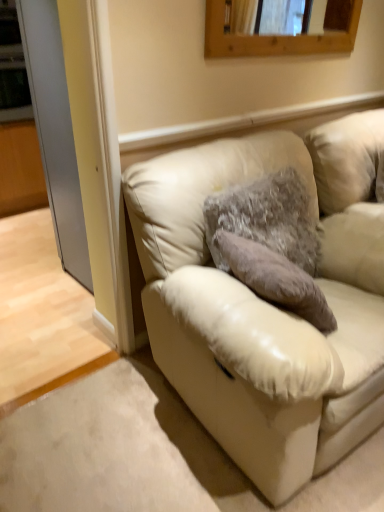
Question: Can you confirm if fuzzy fabric pillow at center is shorter than beige leather couch at lower right?

Choices:
 (A) yes
 (B) no

Answer: (A)

Question: Can you confirm if fuzzy fabric pillow at center is wider than beige leather couch at lower right?

Choices:
 (A) yes
 (B) no

Answer: (B)

Question: Can you confirm if fuzzy fabric pillow at center is positioned to the left of beige leather couch at lower right?

Choices:
 (A) yes
 (B) no

Answer: (A)

Question: Can beige leather couch at lower right be found inside fuzzy fabric pillow at center?

Choices:
 (A) no
 (B) yes

Answer: (A)

Question: Is fuzzy fabric pillow at center oriented towards beige leather couch at lower right?

Choices:
 (A) no
 (B) yes

Answer: (B)

Question: Based on their positions, is wooden frame at upper center located to the left or right of fuzzy fabric pillow at center?

Choices:
 (A) left
 (B) right

Answer: (B)

Question: From a real-world perspective, is wooden frame at upper center positioned above or below fuzzy fabric pillow at center?

Choices:
 (A) below
 (B) above

Answer: (B)

Question: From the image's perspective, is wooden frame at upper center positioned above or below fuzzy fabric pillow at center?

Choices:
 (A) below
 (B) above

Answer: (B)

Question: In the image, is wooden frame at upper center positioned in front of or behind fuzzy fabric pillow at center?

Choices:
 (A) behind
 (B) front

Answer: (A)

Question: Is point (286, 40) positioned closer to the camera than point (38, 5)?

Choices:
 (A) closer
 (B) farther

Answer: (A)

Question: From the image's perspective, is wooden frame at upper center positioned above or below clear glass door at left?

Choices:
 (A) below
 (B) above

Answer: (B)

Question: Looking at their shapes, would you say wooden frame at upper center is wider or thinner than clear glass door at left?

Choices:
 (A) thin
 (B) wide

Answer: (A)

Question: Is wooden frame at upper center inside the boundaries of clear glass door at left, or outside?

Choices:
 (A) outside
 (B) inside

Answer: (A)

Question: From their relative heights in the image, would you say clear glass door at left is taller or shorter than beige leather couch at lower right?

Choices:
 (A) short
 (B) tall

Answer: (B)

Question: Considering the positions of point click(x=69, y=184) and point click(x=329, y=265), is point click(x=69, y=184) closer or farther from the camera than point click(x=329, y=265)?

Choices:
 (A) closer
 (B) farther

Answer: (B)